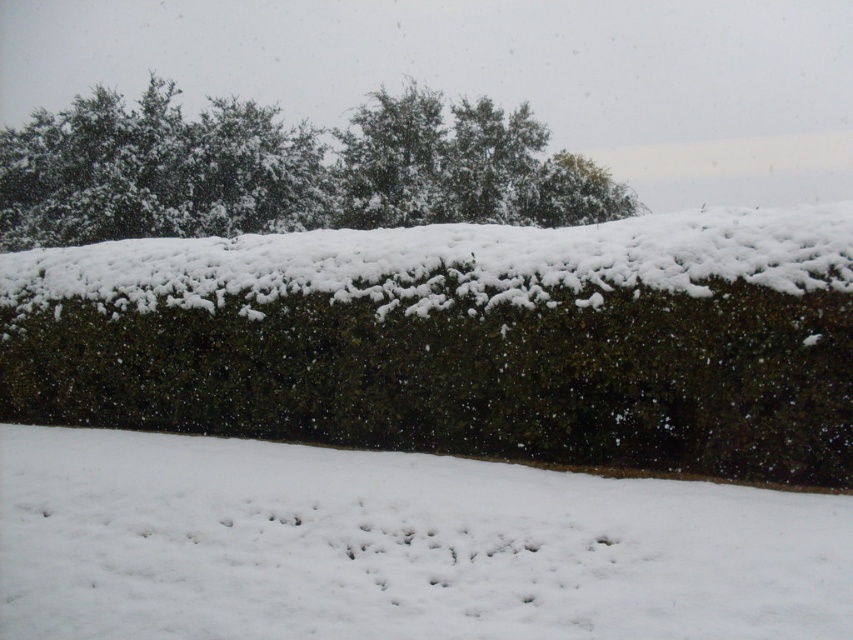
Is white fluffy snow at lower center bigger than green leafy tree at upper center?

No.

Who is more distant from viewer, [811,625] or [343,173]?

Positioned behind is point [343,173].

Does point (35, 579) come behind point (538, 179)?

No, it is in front of (538, 179).

Where is `white fluffy snow at lower center`? The image size is (853, 640). white fluffy snow at lower center is located at coordinates (395, 547).

In the scene shown: Is green leafy hedge at center shorter than green leafy tree at upper center?

Yes, green leafy hedge at center is shorter than green leafy tree at upper center.

From the picture: How distant is green leafy hedge at center from green leafy tree at upper center?

green leafy hedge at center and green leafy tree at upper center are 25.97 meters apart.

Find the location of `green leafy hedge at center`. green leafy hedge at center is located at coordinates (461, 339).

Who is positioned more to the left, green leafy hedge at center or white fluffy snow at lower center?

Positioned to the left is white fluffy snow at lower center.

Which is above, green leafy hedge at center or white fluffy snow at lower center?

Positioned higher is green leafy hedge at center.

Which is in front, point (413, 262) or point (589, 524)?

Point (589, 524)

Find the location of a particular element. This screenshot has width=853, height=640. green leafy hedge at center is located at coordinates (461, 339).